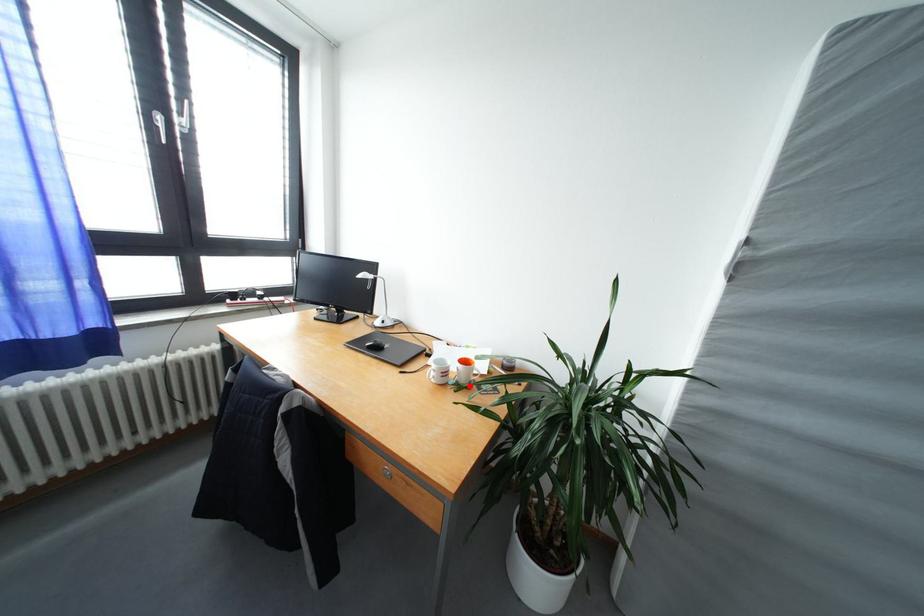
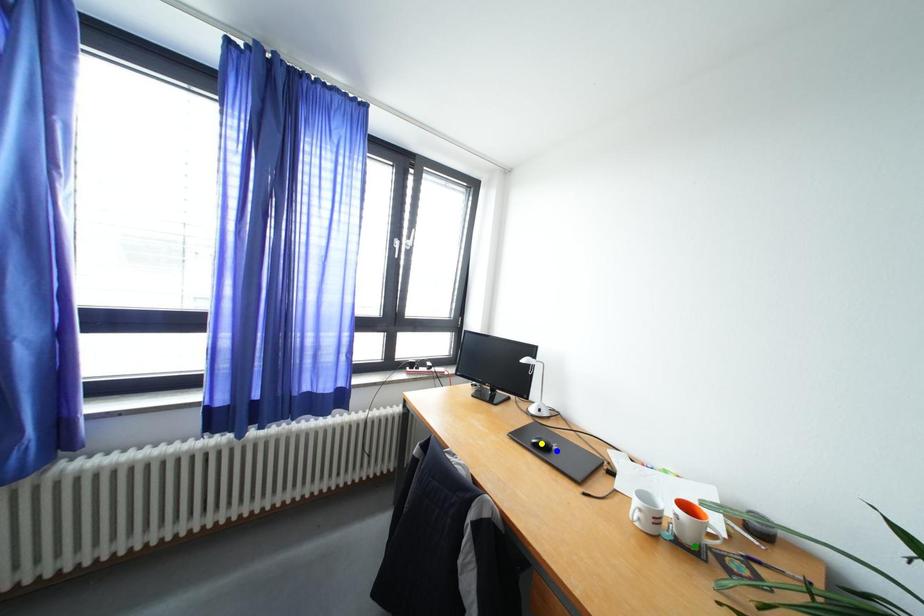
Question: I am providing you with two images of the same scene from different viewpoints. A red point is marked on the first image. You are given multiple points on the second image. Which point in image 2 represents the same 3d spot as the red point in image 1?

Choices:
 (A) blue point
 (B) yellow point
 (C) green point

Answer: (C)